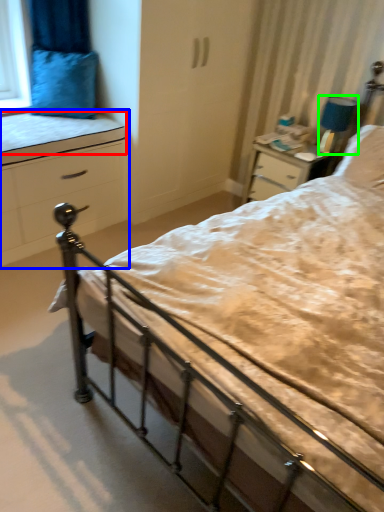
Question: Estimate the real-world distances between objects in this image. Which object is closer to mattress (highlighted by a red box), chest of drawers (highlighted by a blue box) or lamp (highlighted by a green box)?

Choices:
 (A) chest of drawers
 (B) lamp

Answer: (A)